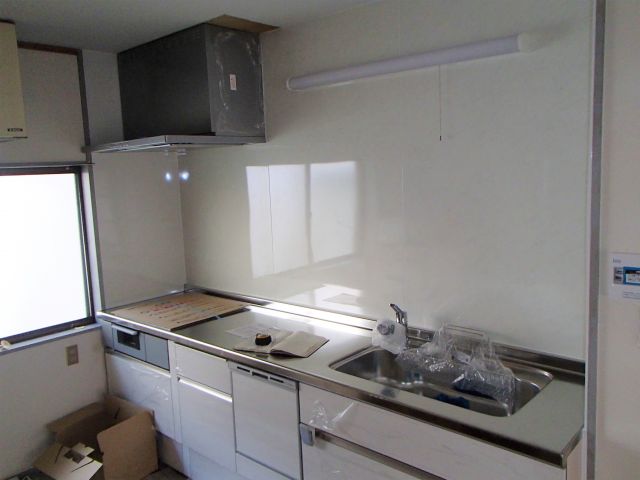
This screenshot has height=480, width=640. What are the coordinates of `window reflection` in the screenshot? It's located at (297, 207).